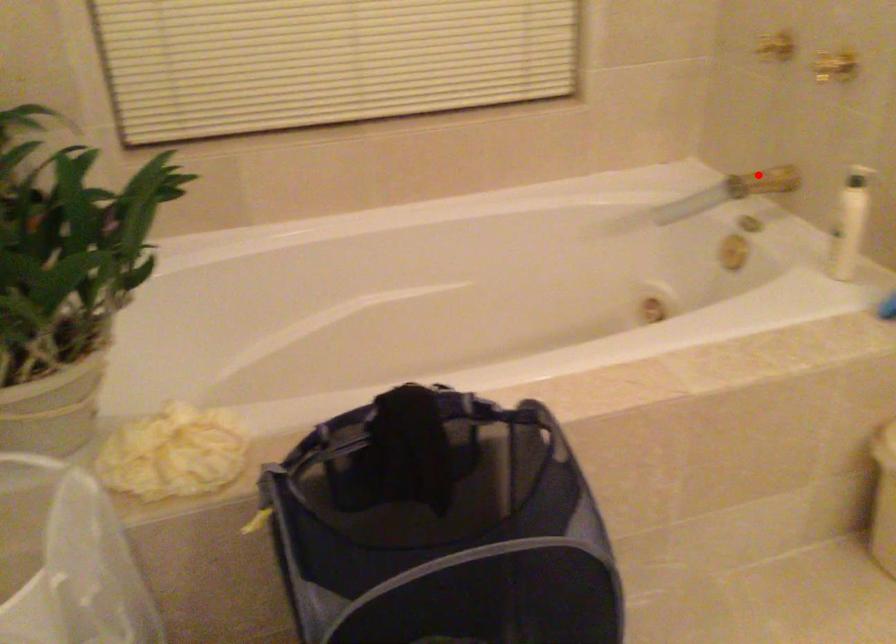
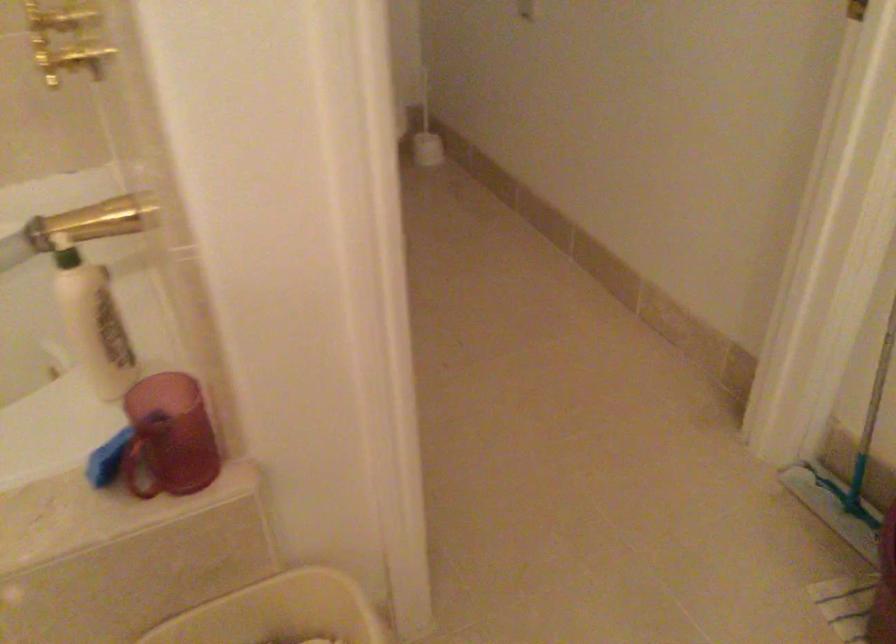
Question: A red point is marked in image1. In image2, is the corresponding 3D point closer to the camera or farther? Reply with the corresponding letter.

Choices:
 (A) The corresponding 3D point is closer.
 (B) The corresponding 3D point is farther.

Answer: (A)